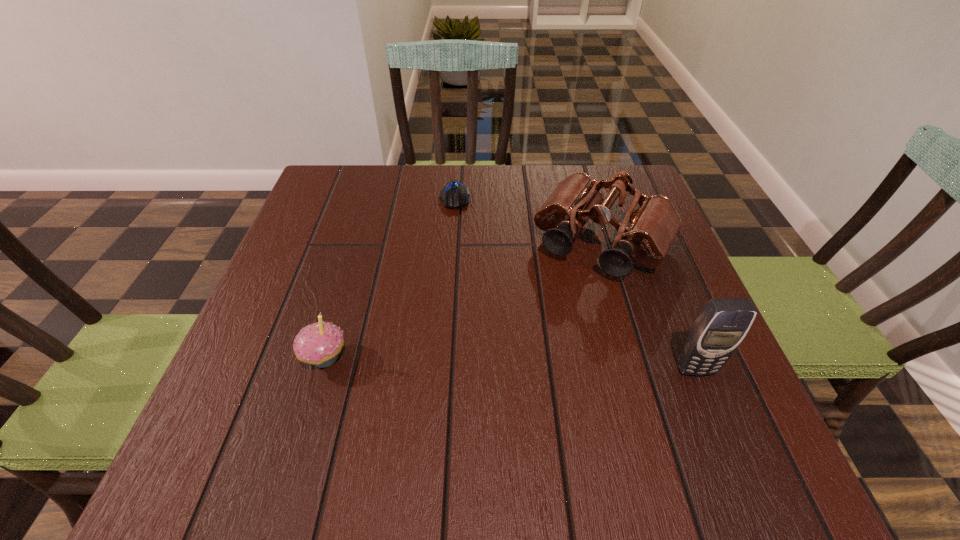
At what (x,y) coordinates should I click in order to perform the action: click on free spot on the desktop that is between the third tallest object and the cellular telephone and is positioned through the eyepieces of the binoculars. Please return your answer as a coordinate pair (x, y). The height and width of the screenshot is (540, 960). Looking at the image, I should click on (530, 364).

The width and height of the screenshot is (960, 540). Identify the location of free space on the desktop that is between the cupcake and the cellular telephone and is positioned on the button side of the shortest object. (461, 362).